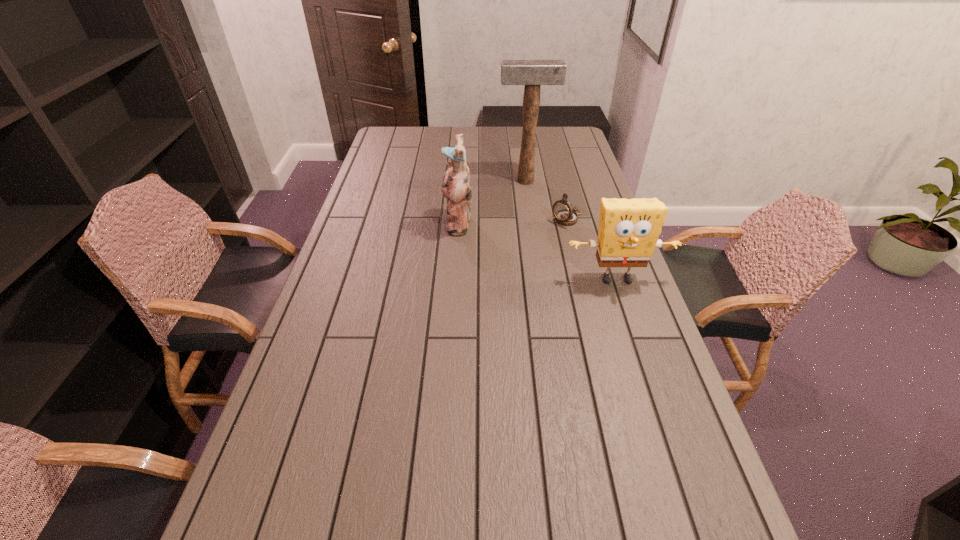
I want to click on blank region between the mallet and the shortest object, so click(x=546, y=200).

Locate an element on the screen. This screenshot has height=540, width=960. free spot between the sponge and the farthest object is located at coordinates (571, 230).

This screenshot has width=960, height=540. What are the coordinates of `free space between the farthest object and the nearest object` in the screenshot? It's located at (571, 230).

Locate an element on the screen. This screenshot has height=540, width=960. empty location between the mallet and the nearest object is located at coordinates (571, 230).

Select which object appears as the second closest to the mallet. Please provide its 2D coordinates. Your answer should be formatted as a tuple, i.e. [(x, y)], where the tuple contains the x and y coordinates of a point satisfying the conditions above.

[(455, 187)]

Identify which object is located as the third nearest to the shortest object. Please provide its 2D coordinates. Your answer should be formatted as a tuple, i.e. [(x, y)], where the tuple contains the x and y coordinates of a point satisfying the conditions above.

[(455, 187)]

Identify the location of free space that satisfies the following two spatial constraints: 1. on the front side of the compass; 2. on the left side of the mallet. This screenshot has width=960, height=540. (531, 219).